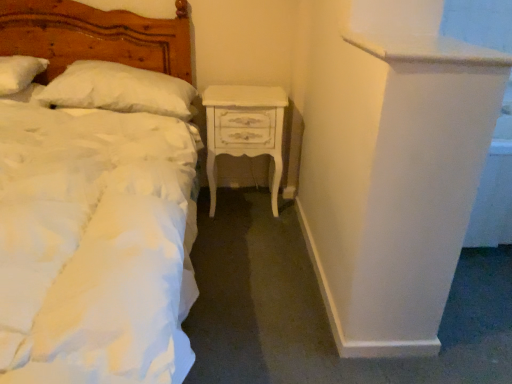
Question: Can you confirm if white soft pillow at upper left, acting as the second pillow starting from the right, is positioned to the left of white fluffy pillow at upper left, which is the 1th pillow in right-to-left order?

Choices:
 (A) yes
 (B) no

Answer: (A)

Question: Can you confirm if white soft pillow at upper left, acting as the second pillow starting from the right, is thinner than white fluffy pillow at upper left, the second pillow from the left?

Choices:
 (A) yes
 (B) no

Answer: (A)

Question: Is white soft pillow at upper left, acting as the second pillow starting from the right, far away from white fluffy pillow at upper left, the second pillow from the left?

Choices:
 (A) yes
 (B) no

Answer: (B)

Question: From a real-world perspective, is white soft pillow at upper left, the 1th pillow from the left, located beneath white fluffy pillow at upper left, which is the 1th pillow in right-to-left order?

Choices:
 (A) yes
 (B) no

Answer: (B)

Question: Considering the relative sizes of white soft pillow at upper left, the 1th pillow from the left, and white fluffy pillow at upper left, the second pillow from the left, in the image provided, is white soft pillow at upper left, the 1th pillow from the left, wider than white fluffy pillow at upper left, the second pillow from the left,?

Choices:
 (A) yes
 (B) no

Answer: (B)

Question: Visually, is white soft pillow at upper left, the 1th pillow from the left, positioned to the left or to the right of matte white bed at left?

Choices:
 (A) left
 (B) right

Answer: (A)

Question: Considering the positions of white soft pillow at upper left, acting as the second pillow starting from the right, and matte white bed at left in the image, is white soft pillow at upper left, acting as the second pillow starting from the right, bigger or smaller than matte white bed at left?

Choices:
 (A) small
 (B) big

Answer: (A)

Question: Considering the positions of white soft pillow at upper left, the 1th pillow from the left, and matte white bed at left in the image, is white soft pillow at upper left, the 1th pillow from the left, wider or thinner than matte white bed at left?

Choices:
 (A) thin
 (B) wide

Answer: (A)

Question: From a real-world perspective, is white soft pillow at upper left, acting as the second pillow starting from the right, physically located above or below matte white bed at left?

Choices:
 (A) above
 (B) below

Answer: (A)

Question: From the image's perspective, relative to white fluffy pillow at upper left, which is the 1th pillow in right-to-left order, is white painted wood nightstand at center above or below?

Choices:
 (A) below
 (B) above

Answer: (A)

Question: Looking at the image, does white painted wood nightstand at center seem bigger or smaller compared to white fluffy pillow at upper left, which is the 1th pillow in right-to-left order?

Choices:
 (A) small
 (B) big

Answer: (B)

Question: Considering the positions of white painted wood nightstand at center and white fluffy pillow at upper left, which is the 1th pillow in right-to-left order, in the image, is white painted wood nightstand at center wider or thinner than white fluffy pillow at upper left, which is the 1th pillow in right-to-left order,?

Choices:
 (A) thin
 (B) wide

Answer: (A)

Question: From a real-world perspective, relative to white fluffy pillow at upper left, which is the 1th pillow in right-to-left order, is white painted wood nightstand at center vertically above or below?

Choices:
 (A) below
 (B) above

Answer: (A)

Question: From the image's perspective, is white soft pillow at upper left, the 1th pillow from the left, above or below white fluffy pillow at upper left, which is the 1th pillow in right-to-left order?

Choices:
 (A) above
 (B) below

Answer: (A)

Question: Choose the correct answer: Is white soft pillow at upper left, acting as the second pillow starting from the right, inside white fluffy pillow at upper left, the second pillow from the left, or outside it?

Choices:
 (A) inside
 (B) outside

Answer: (B)